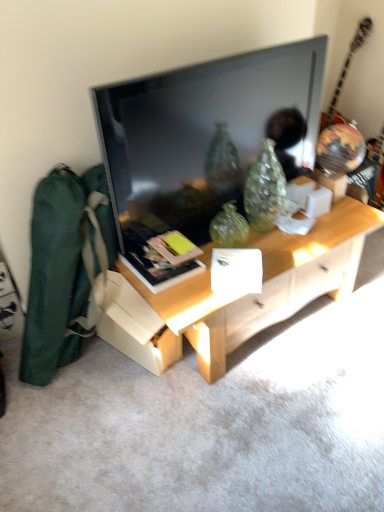
Locate an element on the screen. This screenshot has width=384, height=512. vacant space underneath green canvas messenger bag at left (from a real-world perspective) is located at coordinates (86, 357).